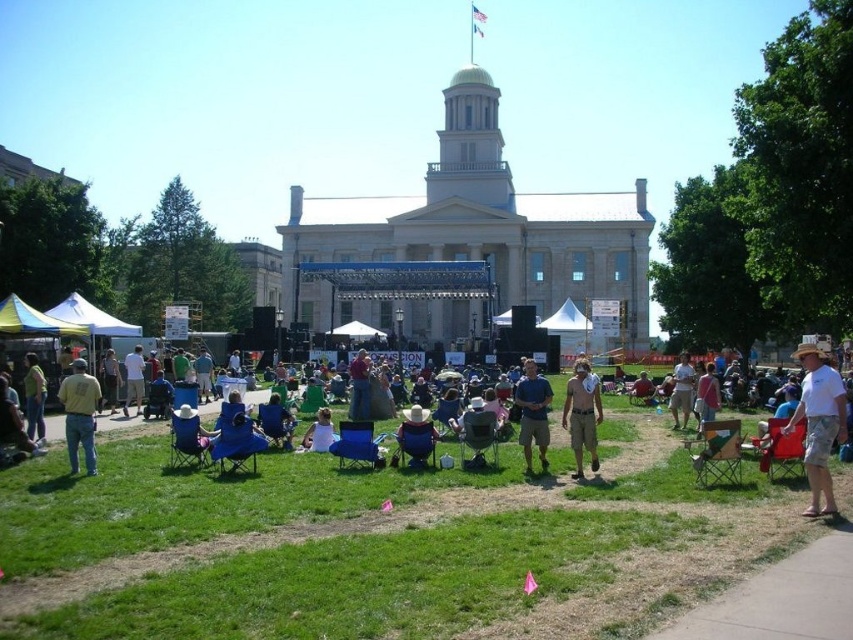
You are standing at the center of the image and want to locate the white cotton shirt at right. In which direction should you look to find it?

The white cotton shirt at right is located at point 0.662 on the x axis and 0.961 on the y axis. Since the x coordinate is 0.662, which is to the right of the center point at 0.5, you should look to the right to find it.

You are a photographer at the event and want to capture a photo that includes both the white cotton shirt at right and the light blue denim jeans at lower left. Based on their positions, which one should you focus on first to ensure both are in frame?

The white cotton shirt at right is located above the light blue denim jeans at lower left, so you should focus on the white cotton shirt at right first to ensure both are in frame.